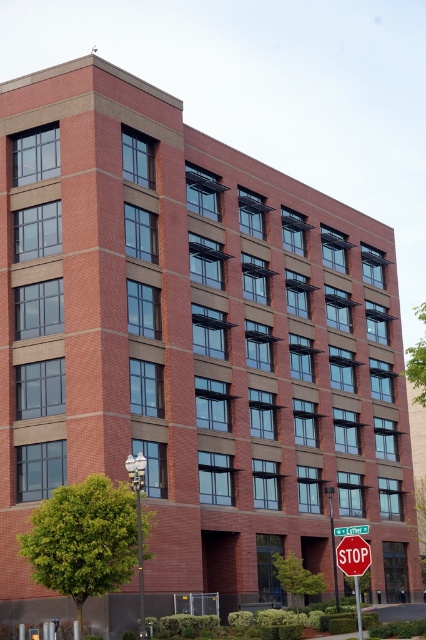
You are a pedestrian standing on the sidewalk in front of the multi story brick building. You see the red plastic stop sign at center and the green plastic street sign at upper center. Which sign is closer to you?

The red plastic stop sign at center is closer to you because it is positioned over the green plastic street sign at upper center, indicating it is in front.

You are standing at the entrance of the multi story brick building and want to reach the red plastic stop sign at center. Which direction should you walk to reach it?

You should walk forward towards the red plastic stop sign at center since it is located at point (353, 556), which is in the center of the scene and in front of the building.